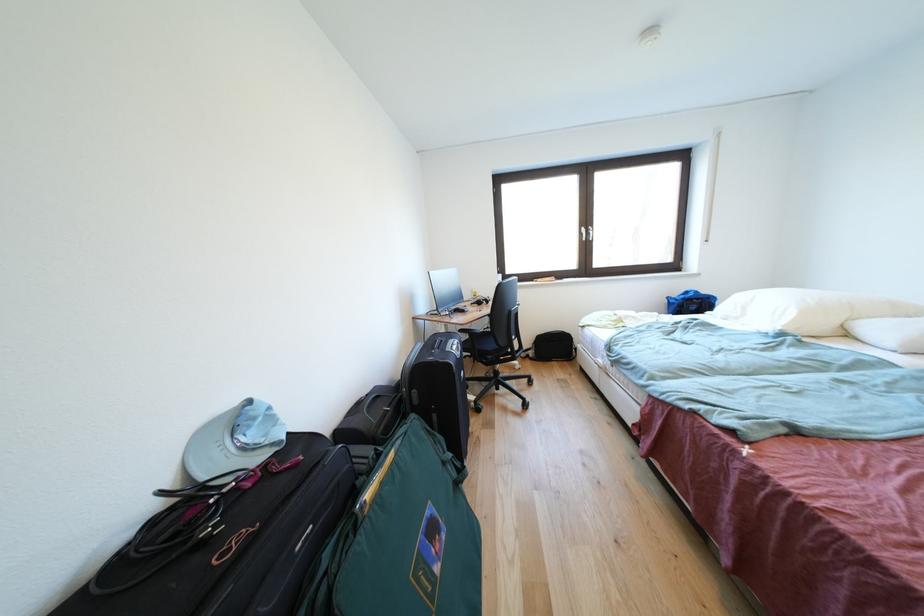
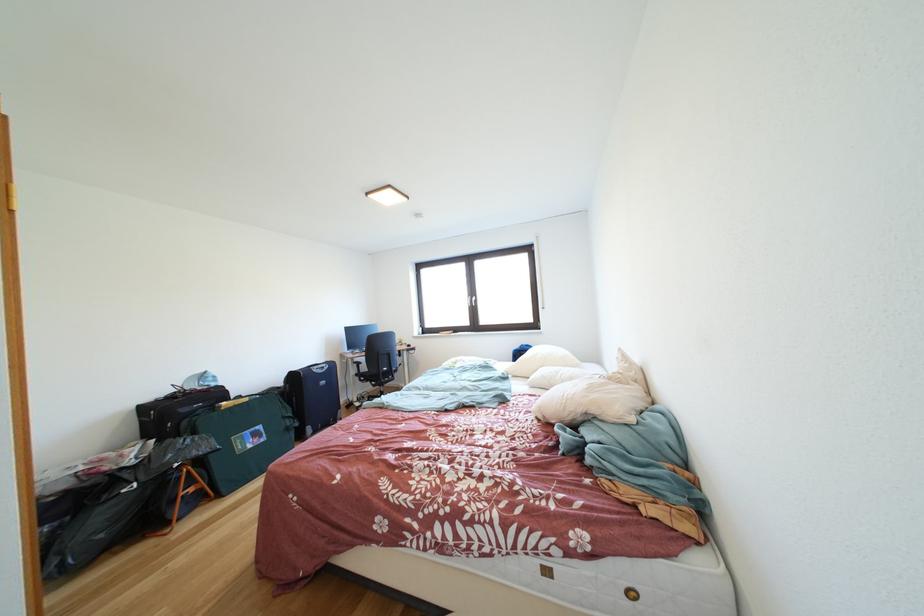
In the second image, find the point that corresponds to [495,369] in the first image.

(383, 391)